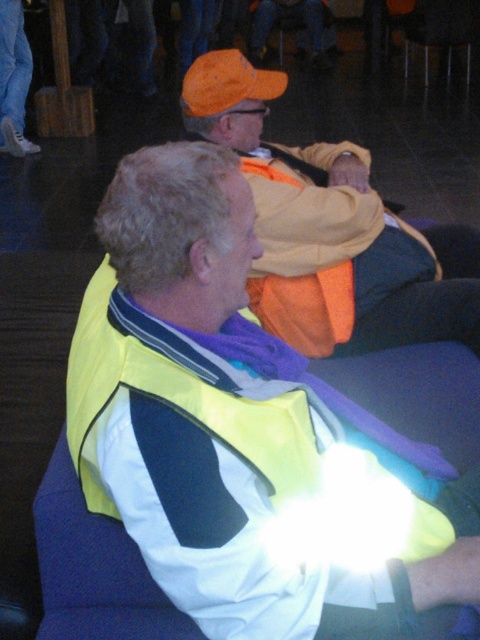
You are standing in front of the two people in the image. You want to place a small sticker on the point that is closer to you. Which point should you choose between point (x=336, y=589) and point (x=314, y=349)?

Point (x=336, y=589) is closer to the camera than point (x=314, y=349), so you should choose point (x=336, y=589) to place the sticker.

You are a security guard checking the safety equipment in the scene. You see the matte orange cap at upper center and the orange reflective vest at center. Which one is taller?

The matte orange cap at upper center is taller than the orange reflective vest at center.